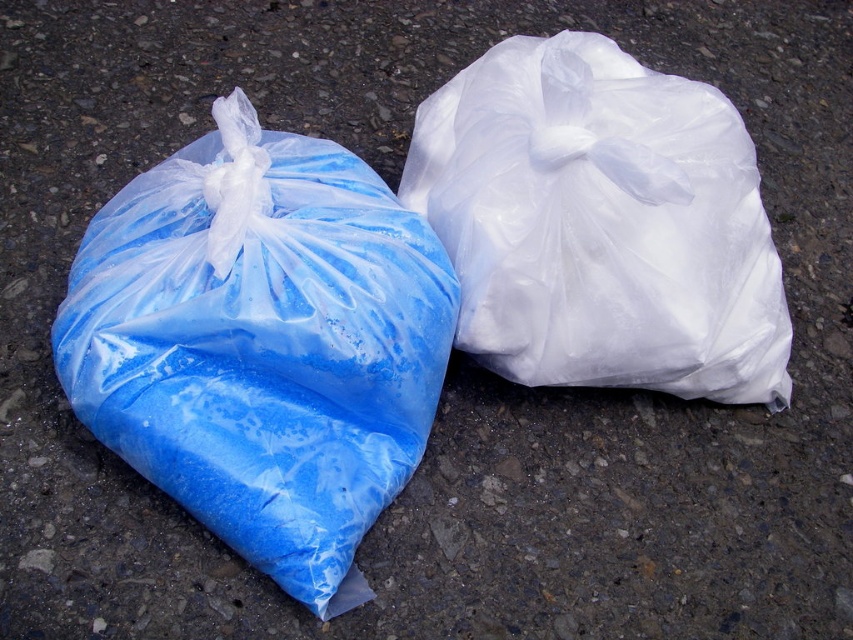
You are a delivery person who needs to stack these two bags for transport. Given that the blue translucent bag at left is heavier than the white translucent bag at right, which bag should you place at the bottom to ensure stability?

The blue translucent bag at left is heavier and should be placed at the bottom to ensure stability since it is already positioned below the white translucent bag at right in the image.

You are a delivery person who needs to stack these two bags on a shelf. The blue translucent bag at left is smaller than the white translucent bag at right. Which bag should you place on top to ensure stability?

The blue translucent bag at left should be placed on top of the white translucent bag at right because it is smaller, which typically provides better stability when stacking items.

You are a delivery person who needs to place both the blue translucent bag at left and the white translucent bag at right into a box that can only hold items up to the width of the wider bag. Which bag should you use as the reference for the box size?

The white translucent bag at right is wider than the blue translucent bag at left. Therefore, you should use the white translucent bag at right as the reference for the box size since it is the wider one.